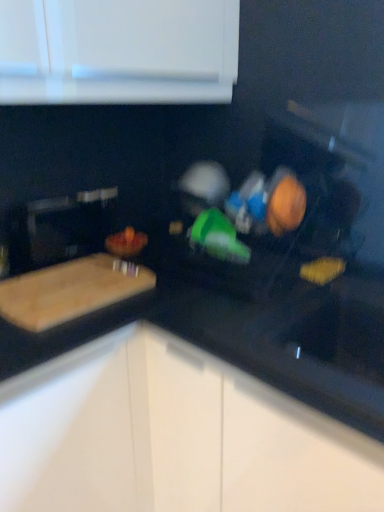
Image resolution: width=384 pixels, height=512 pixels. What are the coordinates of `free location to the right of yellow matte sponge at lower right, positioned as the 3th food in left-to-right order` in the screenshot? It's located at (353, 279).